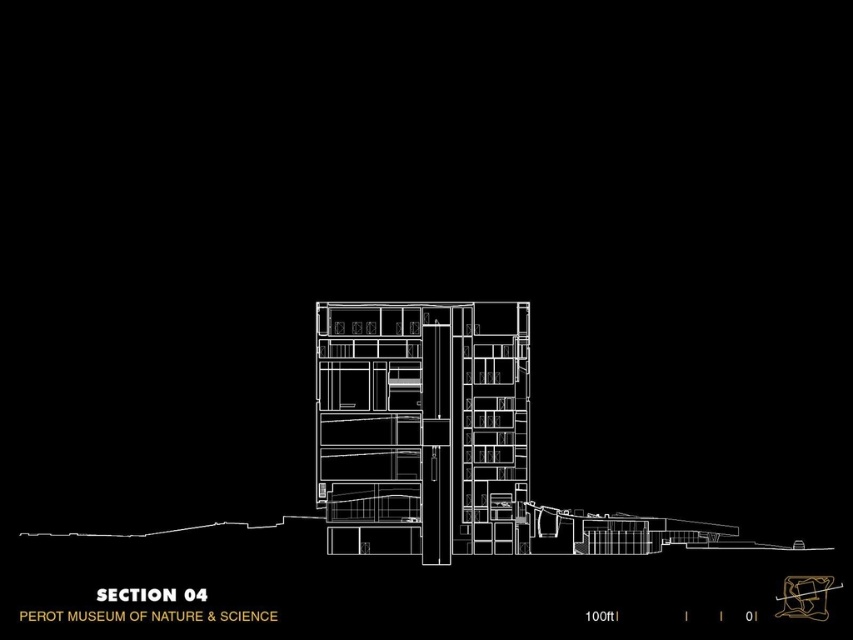
Is translucent glass building at center positioned in front of matte gold sculpture at center?

Yes, it is.

Who is higher up, translucent glass building at center or matte gold sculpture at center?

translucent glass building at center is above.

I want to click on translucent glass building at center, so click(x=422, y=428).